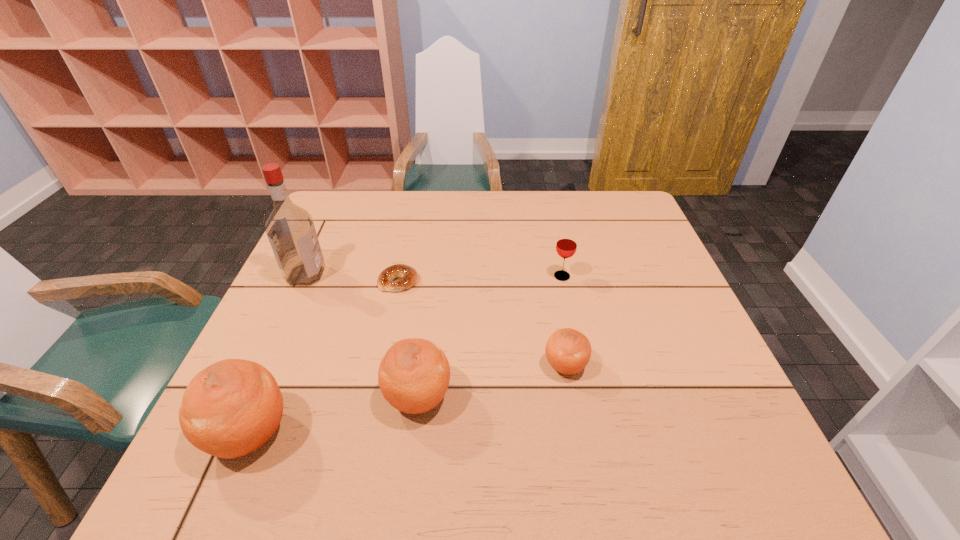
Where is `vacant space in between the tallest object and the leftmost orange`? Image resolution: width=960 pixels, height=540 pixels. vacant space in between the tallest object and the leftmost orange is located at coordinates (278, 355).

This screenshot has height=540, width=960. Find the location of `free space between the shortest orange and the glass`. free space between the shortest orange and the glass is located at coordinates (564, 321).

Select which object is the fifth closest to the second orange from right to left. Please provide its 2D coordinates. Your answer should be formatted as a tuple, i.e. [(x, y)], where the tuple contains the x and y coordinates of a point satisfying the conditions above.

[(566, 245)]

You are a GUI agent. You are given a task and a screenshot of the screen. Output one action in this format:
    pyautogui.click(x=<x>, y=<y>)
    Task: Click on the third closest object relative to the tallest object
    The width and height of the screenshot is (960, 540).
    Given the screenshot: What is the action you would take?
    pyautogui.click(x=414, y=374)

Point out which orange is positioned as the nearest to the glass. Please provide its 2D coordinates. Your answer should be formatted as a tuple, i.e. [(x, y)], where the tuple contains the x and y coordinates of a point satisfying the conditions above.

[(568, 351)]

You are a GUI agent. You are given a task and a screenshot of the screen. Output one action in this format:
    pyautogui.click(x=<x>, y=<y>)
    Task: Click on the second closest orange to the second orange from right to left
    This screenshot has width=960, height=540.
    Given the screenshot: What is the action you would take?
    pyautogui.click(x=568, y=351)

You are a GUI agent. You are given a task and a screenshot of the screen. Output one action in this format:
    pyautogui.click(x=<x>, y=<y>)
    Task: Click on the free space that satisfies the following two spatial constraints: 1. on the front-facing side of the bagel; 2. on the right side of the liquor
    This screenshot has height=540, width=960.
    Given the screenshot: What is the action you would take?
    pyautogui.click(x=303, y=281)

Where is `vacant area in the image that satisfies the following two spatial constraints: 1. on the back side of the fifth tallest object; 2. on the front-facing side of the liquor`? The width and height of the screenshot is (960, 540). vacant area in the image that satisfies the following two spatial constraints: 1. on the back side of the fifth tallest object; 2. on the front-facing side of the liquor is located at coordinates (549, 275).